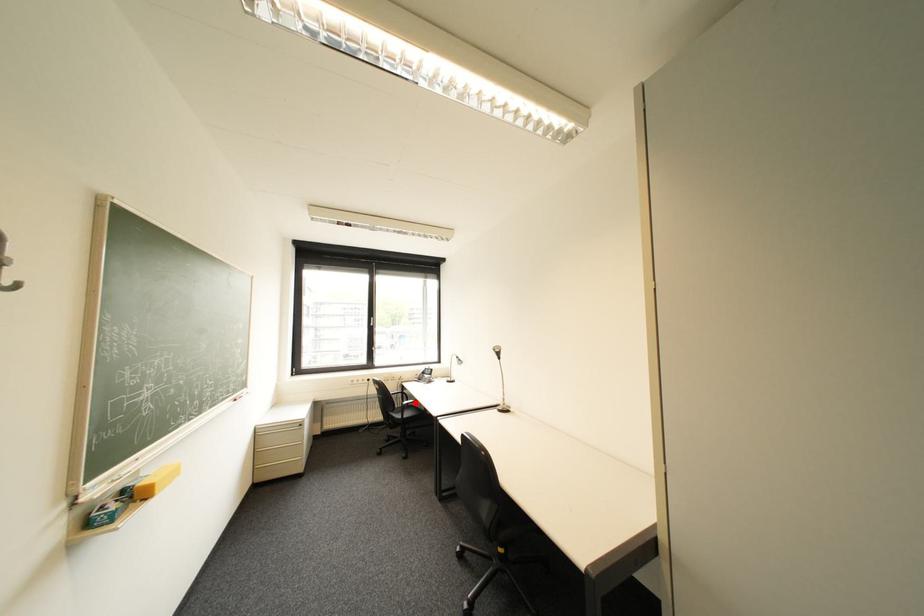
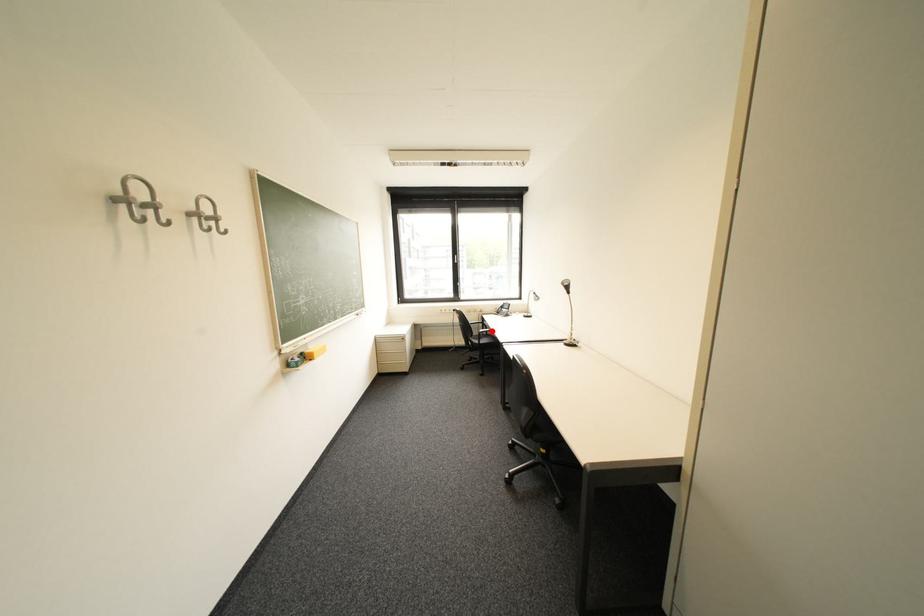
I am providing you with two images of the same scene from different viewpoints. A red point is marked on the first image and another point is marked on the second image. Does the point marked in image1 correspond to the same location as the one in image2?

Yes